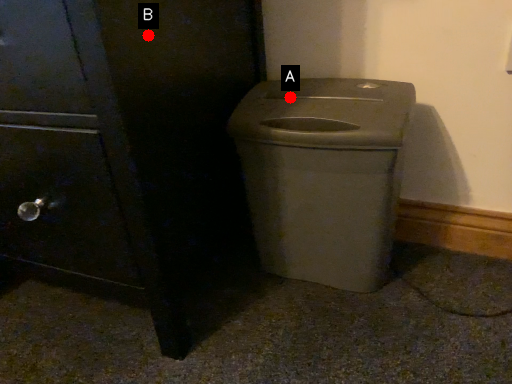
Question: Two points are circled on the image, labeled by A and B beside each circle. Which point is further to the camera?

Choices:
 (A) A is further
 (B) B is further

Answer: (A)